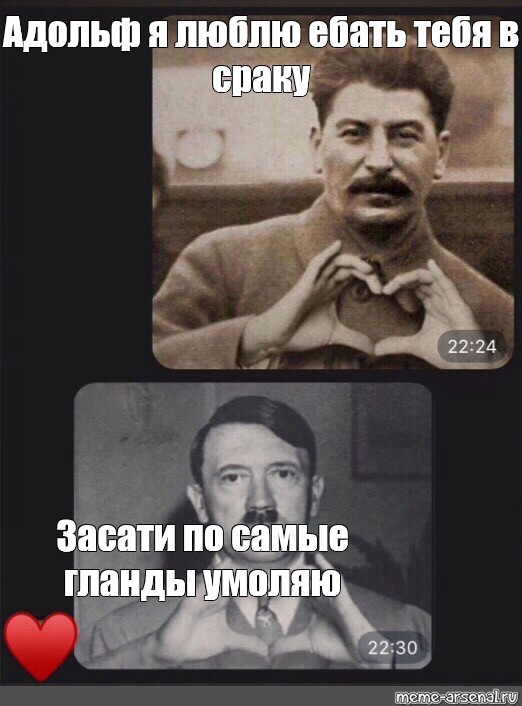
Locate an element on the screen. plant in the background is located at coordinates (409, 587).